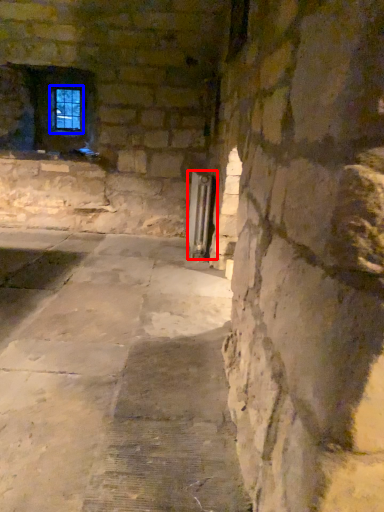
Question: Among these objects, which one is farthest to the camera, elevator (highlighted by a red box) or window frame (highlighted by a blue box)?

Choices:
 (A) elevator
 (B) window frame

Answer: (B)